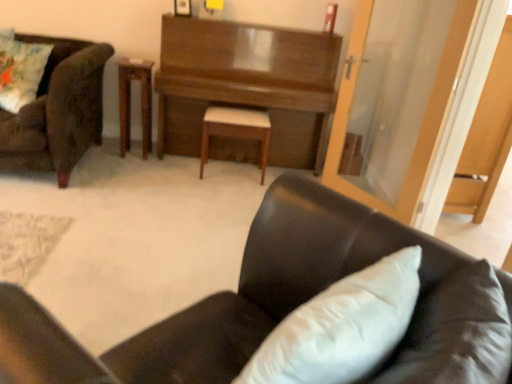
At what (x,y) coordinates should I click in order to perform the action: click on vacant space situated on the left part of wooden table at center. Please return your answer as a coordinate pair (x, y). The width and height of the screenshot is (512, 384). Looking at the image, I should click on (104, 152).